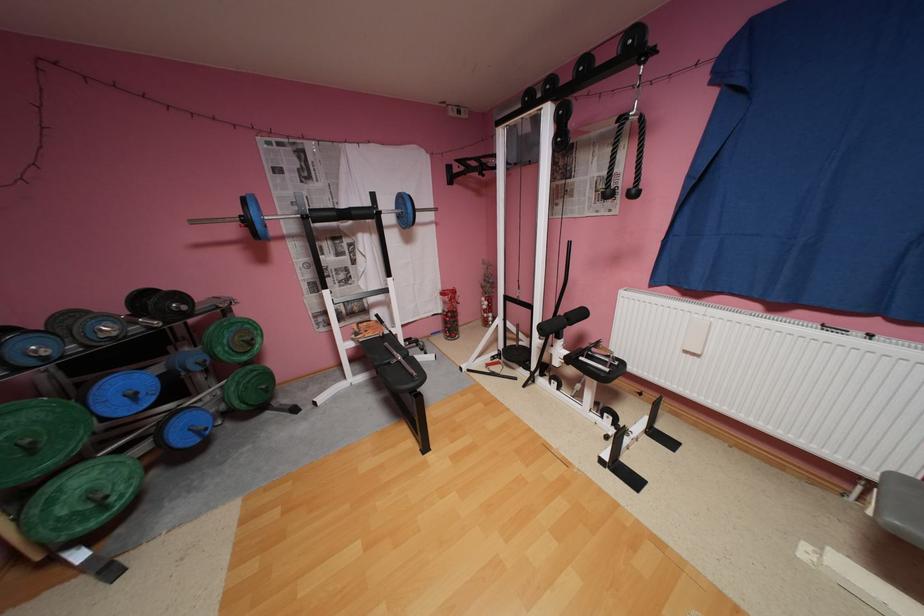
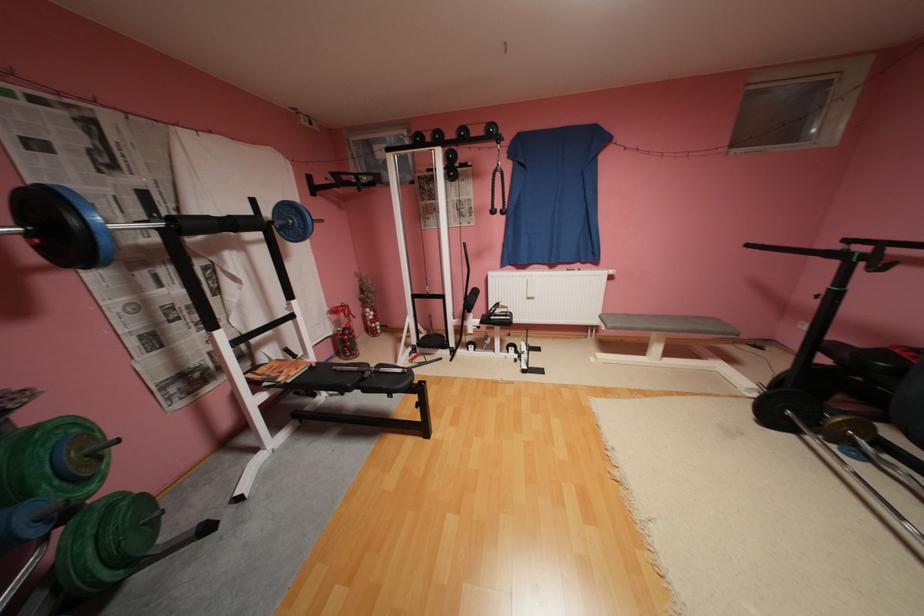
The point at (370, 339) is marked in the first image. Where is the corresponding point in the second image?

(298, 381)